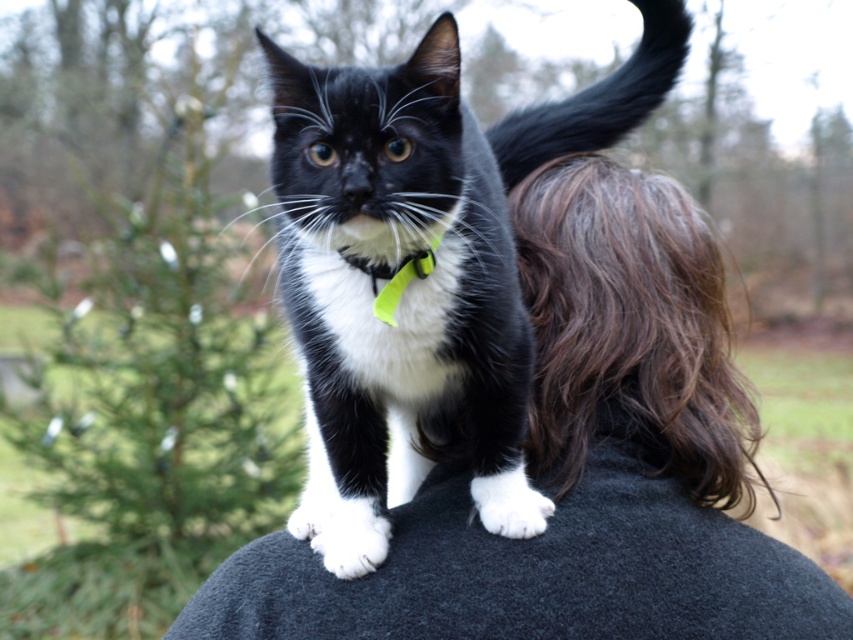
Question: Considering the real-world distances, which object is closest to the neon green fabric at center?

Choices:
 (A) black glossy fur cat at center
 (B) white matte mouth at center

Answer: (B)

Question: From the image, what is the correct spatial relationship of black glossy fur cat at center in relation to neon green fabric at center?

Choices:
 (A) left
 (B) right

Answer: (B)

Question: Does neon green fabric at center appear over white matte mouth at center?

Choices:
 (A) no
 (B) yes

Answer: (A)

Question: Among these points, which one is nearest to the camera?

Choices:
 (A) (x=349, y=227)
 (B) (x=450, y=84)

Answer: (A)

Question: Is neon green fabric at center bigger than white matte mouth at center?

Choices:
 (A) no
 (B) yes

Answer: (B)

Question: Which of the following is the farthest from the observer?

Choices:
 (A) click(x=585, y=122)
 (B) click(x=413, y=276)
 (C) click(x=381, y=230)

Answer: (A)